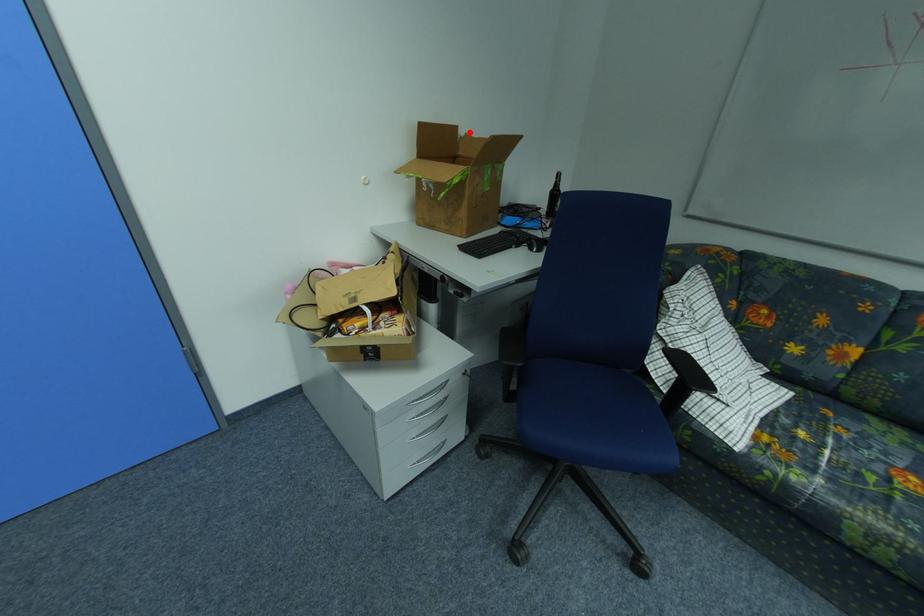
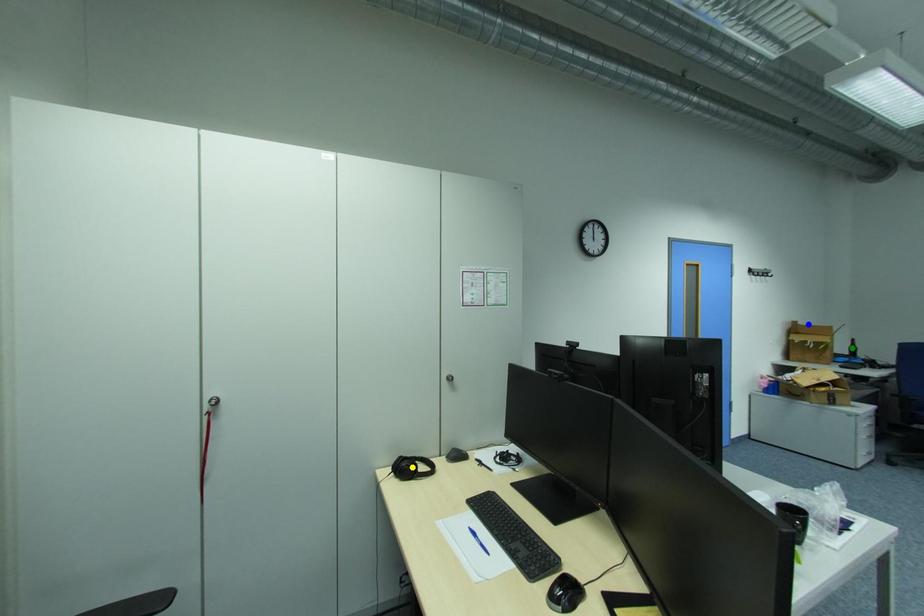
Question: I am providing you with two images of the same scene from different viewpoints. A red point is marked on the first image. You are given multiple points on the second image. Which spot in image 2 lines up with the point in image 1?

Choices:
 (A) blue point
 (B) yellow point
 (C) green point

Answer: (A)